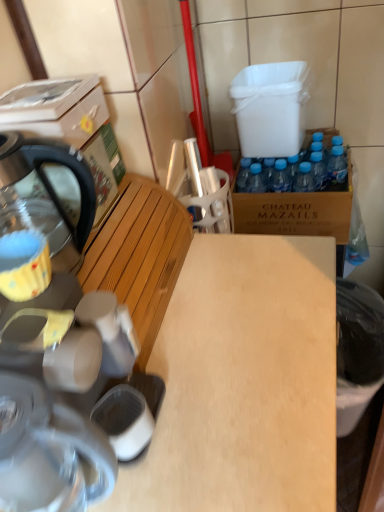
The image size is (384, 512). I want to click on wooden bench at left, so click(x=140, y=255).

Measure the distance between wooden bench at left and camera.

The distance of wooden bench at left from camera is 27.07 inches.

Measure the distance between light wood desk at center and camera.

The depth of light wood desk at center is 20.88 inches.

At what (x,y) coordinates should I click in order to perform the action: click on brown cardboard box at right. Please return your answer as a coordinate pair (x, y). Image resolution: width=384 pixels, height=512 pixels. Looking at the image, I should click on (295, 211).

What is the approximate height of black plastic trash can at lower right?

21.40 centimeters.

Identify the location of metallic silver kettle at left. The image size is (384, 512). (70, 127).

Locate an element on the screen. This screenshot has height=512, width=384. yellow fabric coffee cup at left is located at coordinates (24, 265).

In order to click on stainless steel kettle at left in this screenshot , I will do `click(52, 186)`.

Is brown cardboard box at right turned away from yellow fabric coffee cup at left?

That's not correct — brown cardboard box at right is not looking away from yellow fabric coffee cup at left.

What's the angular difference between brown cardboard box at right and yellow fabric coffee cup at left's facing directions?

The angle between the facing direction of brown cardboard box at right and the facing direction of yellow fabric coffee cup at left is 89.1 degrees.

Based on the photo, can you see brown cardboard box at right touching yellow fabric coffee cup at left?

There is a gap between brown cardboard box at right and yellow fabric coffee cup at left.

In the image, is brown cardboard box at right positioned in front of or behind yellow fabric coffee cup at left?

brown cardboard box at right is positioned farther from the viewer than yellow fabric coffee cup at left.

From the image's perspective, which one is positioned lower, yellow fabric coffee cup at left or light wood desk at center?

light wood desk at center appears lower in the image.

Considering the positions of point (36, 294) and point (210, 461), is point (36, 294) closer or farther from the camera than point (210, 461)?

Point (36, 294).

From a real-world perspective, is yellow fabric coffee cup at left physically located above or below light wood desk at center?

yellow fabric coffee cup at left is above light wood desk at center.

Is light wood desk at center at the back of yellow fabric coffee cup at left?

That's not correct — yellow fabric coffee cup at left is not looking away from light wood desk at center.

Which object is positioned more to the left, metallic silver kettle at left or yellow fabric coffee cup at left?

Positioned to the left is metallic silver kettle at left.

Where is `box lying behind the yellow fabric coffee cup at left`? The width and height of the screenshot is (384, 512). box lying behind the yellow fabric coffee cup at left is located at coordinates (70, 127).

Is yellow fabric coffee cup at left surrounded by metallic silver kettle at left?

No, yellow fabric coffee cup at left is located outside of metallic silver kettle at left.

From the image's perspective, which one is positioned higher, metallic silver kettle at left or yellow fabric coffee cup at left?

metallic silver kettle at left, from the image's perspective.

Is wooden bench at left not inside metallic silver kettle at left?

Absolutely, wooden bench at left is external to metallic silver kettle at left.

Can you confirm if wooden bench at left is positioned to the right of metallic silver kettle at left?

Yes.

Is wooden bench at left not near metallic silver kettle at left?

wooden bench at left is near metallic silver kettle at left, not far away.

From the image's perspective, between light wood desk at center and black plastic trash can at lower right, who is located below?

light wood desk at center is shown below in the image.

Is light wood desk at center inside the boundaries of black plastic trash can at lower right, or outside?

light wood desk at center exists outside the volume of black plastic trash can at lower right.

Which of these two, light wood desk at center or black plastic trash can at lower right, stands shorter?

black plastic trash can at lower right.

Is light wood desk at center wider than black plastic trash can at lower right?

Indeed, light wood desk at center has a greater width compared to black plastic trash can at lower right.

From a real-world perspective, is metallic silver kettle at left above or below brown cardboard box at right?

metallic silver kettle at left is situated higher than brown cardboard box at right in the real world.

Is metallic silver kettle at left facing away from brown cardboard box at right?

No, metallic silver kettle at left's orientation is not away from brown cardboard box at right.

At what (x,y) coordinates should I click in order to perform the action: click on cardboard box above the metallic silver kettle at left (from the image's perspective). Please return your answer as a coordinate pair (x, y). This screenshot has width=384, height=512. Looking at the image, I should click on (295, 211).

Is metallic silver kettle at left shorter than brown cardboard box at right?

Indeed, metallic silver kettle at left has a lesser height compared to brown cardboard box at right.

Between point (20, 133) and point (51, 478), which one is positioned behind?

Positioned behind is point (20, 133).

Looking at this image, how different are the orientations of metallic silver kettle at left and matte gray coffee machine at lower left in degrees?

The facing directions of metallic silver kettle at left and matte gray coffee machine at lower left are 0.000156 degrees apart.

In the image, is metallic silver kettle at left positioned in front of or behind matte gray coffee machine at lower left?

In the image, metallic silver kettle at left appears behind matte gray coffee machine at lower left.

Image resolution: width=384 pixels, height=512 pixels. Identify the location of box above the matte gray coffee machine at lower left (from the image's perspective). (70, 127).

You are a GUI agent. You are given a task and a screenshot of the screen. Output one action in this format:
    pyautogui.click(x=<x>, y=<y>)
    Task: Click on the coffee cup above the brown cardboard box at right (from a real-world perspective)
    The image size is (384, 512).
    Given the screenshot: What is the action you would take?
    pyautogui.click(x=24, y=265)

Image resolution: width=384 pixels, height=512 pixels. In order to click on coffee cup that is behind the light wood desk at center in this screenshot , I will do `click(24, 265)`.

From the picture: When comparing their distances from metallic silver kettle at left, does yellow fabric coffee cup at left or matte gray coffee machine at lower left seem closer?

matte gray coffee machine at lower left is positioned closer to the anchor metallic silver kettle at left.

From the image, which object appears to be farther from metallic silver kettle at left, stainless steel kettle at left or light wood desk at center?

Based on the image, light wood desk at center appears to be further to metallic silver kettle at left.

Consider the image. Estimate the real-world distances between objects in this image. Which object is closer to metallic silver kettle at left, matte gray coffee machine at lower left or light wood desk at center?

Among the two, matte gray coffee machine at lower left is located nearer to metallic silver kettle at left.

When comparing their distances from matte gray coffee machine at lower left, does stainless steel kettle at left or metallic silver kettle at left seem further?

metallic silver kettle at left is positioned further to the anchor matte gray coffee machine at lower left.

Considering their positions, is brown cardboard box at right positioned further to matte gray coffee machine at lower left than wooden bench at left?

brown cardboard box at right is positioned further to the anchor matte gray coffee machine at lower left.

From the picture: Based on their spatial positions, is yellow fabric coffee cup at left or brown cardboard box at right closer to wooden bench at left?

Based on the image, yellow fabric coffee cup at left appears to be nearer to wooden bench at left.

Based on their spatial positions, is matte gray coffee machine at lower left or stainless steel kettle at left further from light wood desk at center?

stainless steel kettle at left lies further to light wood desk at center than the other object.

Considering their positions, is metallic silver kettle at left positioned further to light wood desk at center than yellow fabric coffee cup at left?

yellow fabric coffee cup at left lies further to light wood desk at center than the other object.

Image resolution: width=384 pixels, height=512 pixels. I want to click on kettle between metallic silver kettle at left and black plastic trash can at lower right, so click(52, 186).

Where is `cardboard box between metallic silver kettle at left and black plastic trash can at lower right`? The height and width of the screenshot is (512, 384). cardboard box between metallic silver kettle at left and black plastic trash can at lower right is located at coordinates (295, 211).

Where is `coffee cup between stainless steel kettle at left and matte gray coffee machine at lower left from top to bottom`? The width and height of the screenshot is (384, 512). coffee cup between stainless steel kettle at left and matte gray coffee machine at lower left from top to bottom is located at coordinates (24, 265).

Locate an element on the screen. The width and height of the screenshot is (384, 512). kettle between matte gray coffee machine at lower left and brown cardboard box at right along the z-axis is located at coordinates (52, 186).